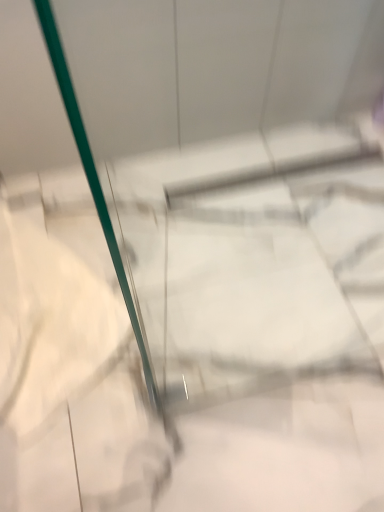
Find the location of `white matte fabric at lower left`. white matte fabric at lower left is located at coordinates (70, 374).

What do you see at coordinates (70, 374) in the screenshot? This screenshot has width=384, height=512. I see `white matte fabric at lower left` at bounding box center [70, 374].

Locate an element on the screen. white matte fabric at lower left is located at coordinates (70, 374).